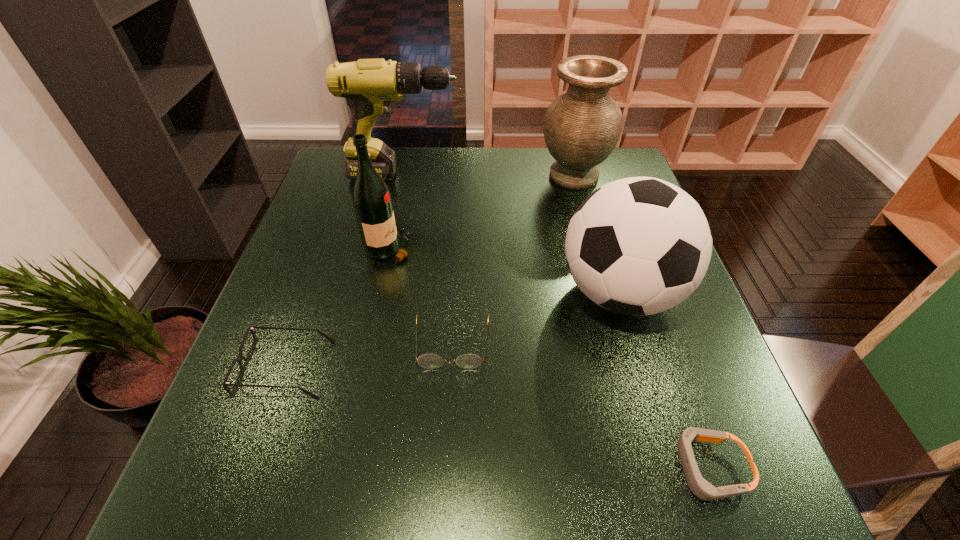
Locate an element on the screen. The image size is (960, 540). free area in between the wine bottle and the soccer ball is located at coordinates (505, 271).

Identify the location of free space between the drill and the vase. The image size is (960, 540). (489, 176).

The width and height of the screenshot is (960, 540). I want to click on object that stands as the fourth closest to the right spectacles, so click(701, 488).

Select which object appears as the sixth closest to the soccer ball. Please provide its 2D coordinates. Your answer should be formatted as a tuple, i.e. [(x, y)], where the tuple contains the x and y coordinates of a point satisfying the conditions above.

[(240, 357)]

Locate an element on the screen. This screenshot has width=960, height=540. vacant space that satisfies the following two spatial constraints: 1. on the handle side of the drill; 2. on the left side of the soccer ball is located at coordinates (379, 293).